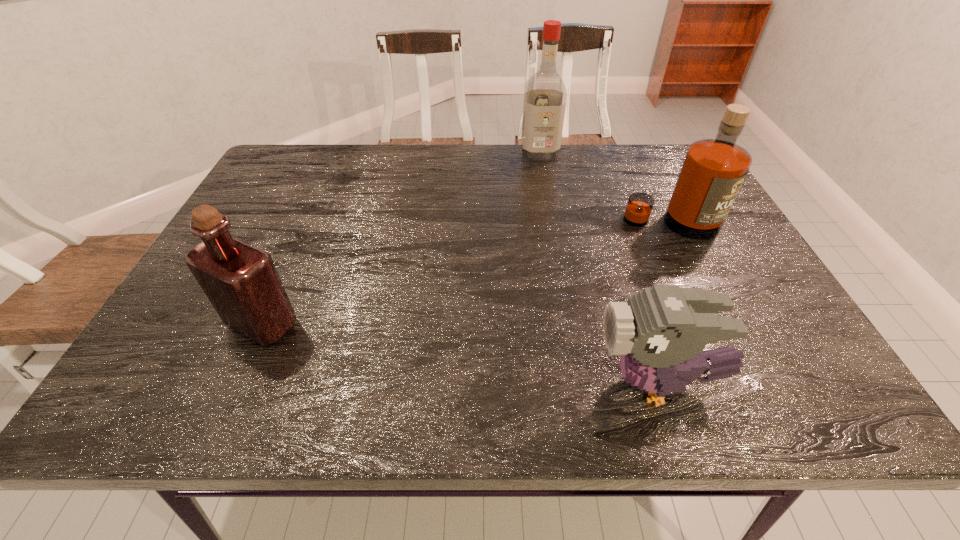
Identify the location of unoccupied position between the second farthest liquor and the nearest liquor. This screenshot has width=960, height=540. (467, 274).

The height and width of the screenshot is (540, 960). Find the location of `object that stands as the second closest to the second nearest liquor`. object that stands as the second closest to the second nearest liquor is located at coordinates (660, 332).

Identify which object is the second closest to the leftmost object. Please provide its 2D coordinates. Your answer should be formatted as a tuple, i.e. [(x, y)], where the tuple contains the x and y coordinates of a point satisfying the conditions above.

[(545, 96)]

Select which liquor is the closest to the second liquor from left to right. Please provide its 2D coordinates. Your answer should be formatted as a tuple, i.e. [(x, y)], where the tuple contains the x and y coordinates of a point satisfying the conditions above.

[(713, 171)]

You are a GUI agent. You are given a task and a screenshot of the screen. Output one action in this format:
    pyautogui.click(x=<x>, y=<y>)
    Task: Click on the liquor that is the second nearest to the shortest object
    The width and height of the screenshot is (960, 540).
    Given the screenshot: What is the action you would take?
    pyautogui.click(x=242, y=283)